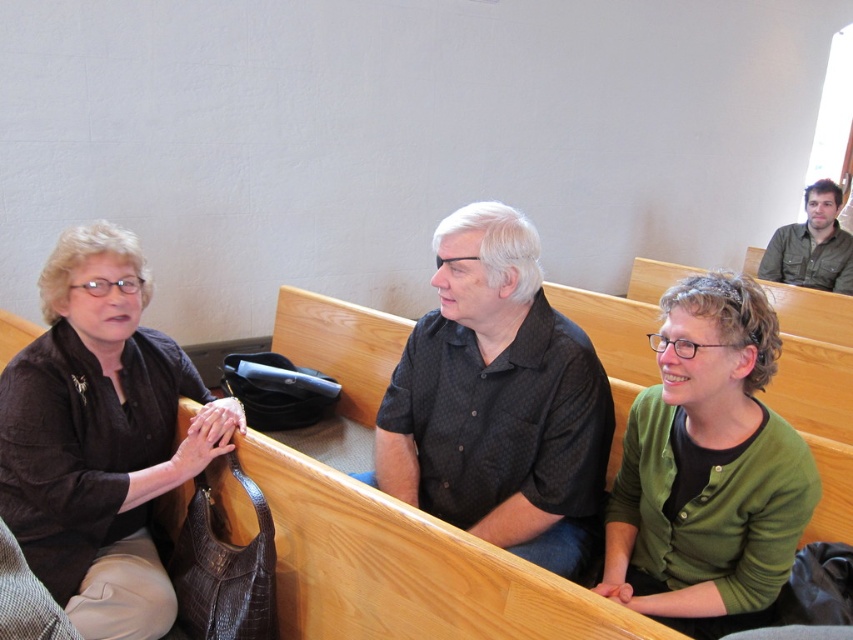
Question: Can you confirm if green cardigan at center is bigger than green textured shirt at upper right?

Choices:
 (A) yes
 (B) no

Answer: (B)

Question: Which point appears closest to the camera in this image?

Choices:
 (A) (140, 291)
 (B) (608, 406)

Answer: (B)

Question: Among these points, which one is nearest to the camera?

Choices:
 (A) (566, 512)
 (B) (146, 541)

Answer: (A)

Question: Can you confirm if matte brown purse at left is bigger than green textured shirt at upper right?

Choices:
 (A) yes
 (B) no

Answer: (A)

Question: Which point appears closest to the camera in this image?

Choices:
 (A) tap(753, 588)
 (B) tap(820, 288)
 (C) tap(480, 516)
 (D) tap(219, 408)

Answer: (A)

Question: Can you confirm if matte brown purse at left is positioned above black dotted shirt at center?

Choices:
 (A) no
 (B) yes

Answer: (A)